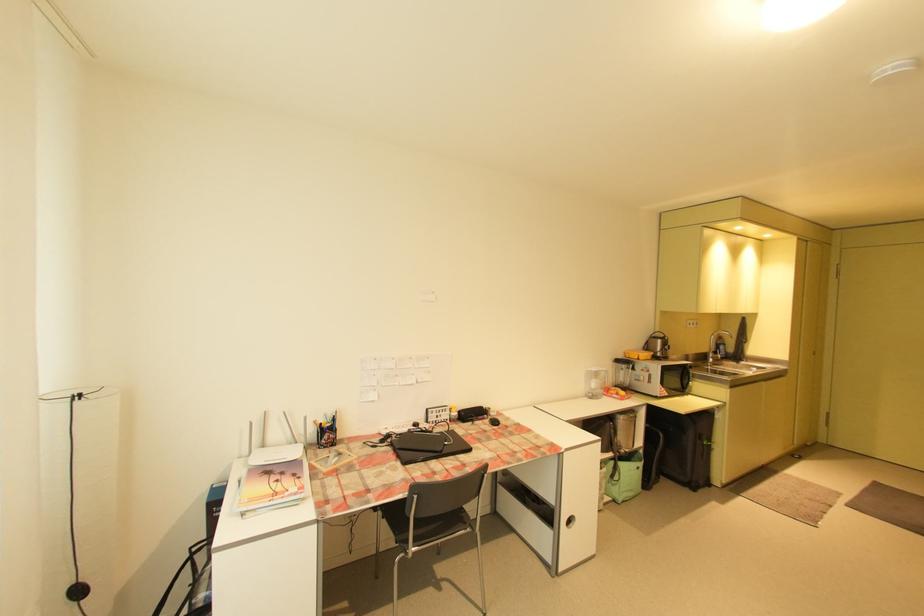
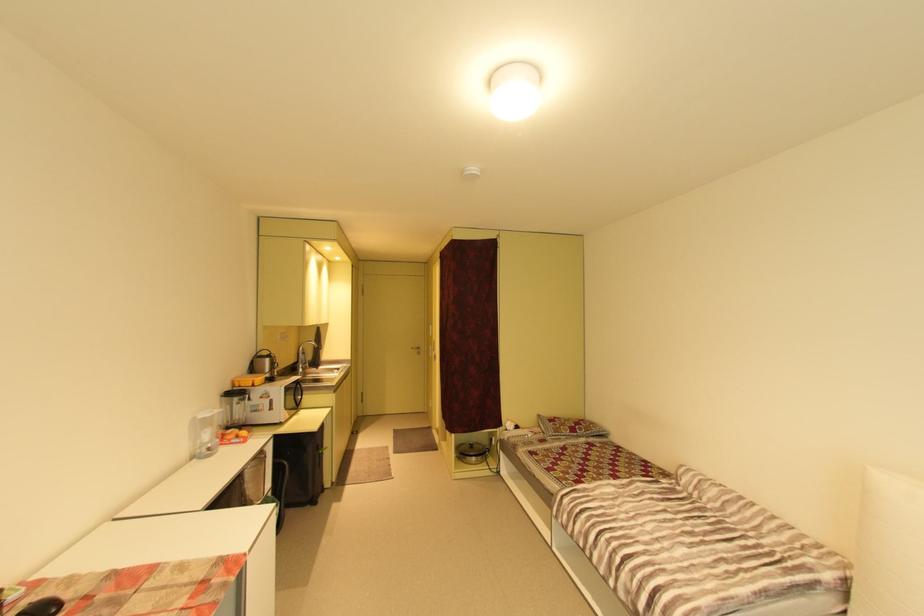
In the second image, find the point that corresponds to the point at 686,381 in the first image.

(299, 398)